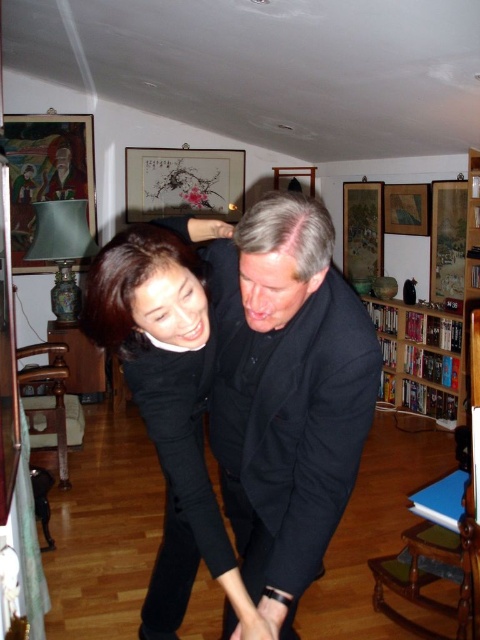
You are a fashion designer who needs to hang a dress on a hanger in the living room. The dress is the black matte dress at center. You want to place it near the wooden bookshelf at right. Given that the hanger requires 1 meter of space to hang properly, is there enough space between the dress and the bookshelf to do this?

The distance between the black matte dress at center and the wooden bookshelf at right is 3.02 meters. Since the hanger needs 1 meter of space, there is more than enough space to hang the dress near the bookshelf.

You are standing in the living room and see the black matte dress at center. If you want to reach it without moving your feet, can you do it?

The black matte dress at center is 35.67 inches away from viewer. Since the average human arm length is about 25 inches, you cannot reach it without moving your feet.